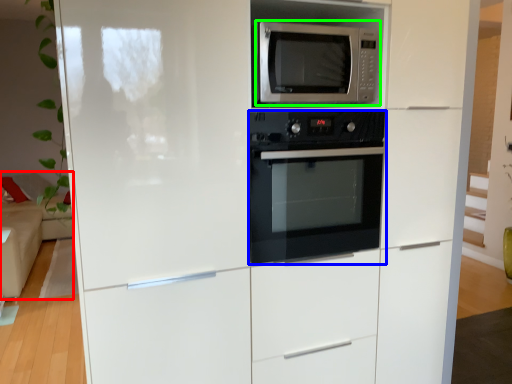
Question: Estimate the real-world distances between objects in this image. Which object is closer to couch (highlighted by a red box), oven (highlighted by a blue box) or microwave oven (highlighted by a green box)?

Choices:
 (A) oven
 (B) microwave oven

Answer: (A)